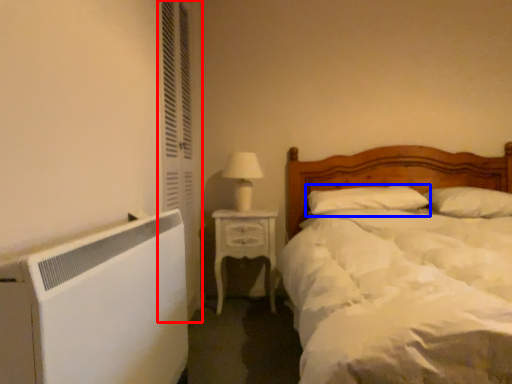
Question: Which object is further to the camera taking this photo, screen door (highlighted by a red box) or pillow (highlighted by a blue box)?

Choices:
 (A) screen door
 (B) pillow

Answer: (B)